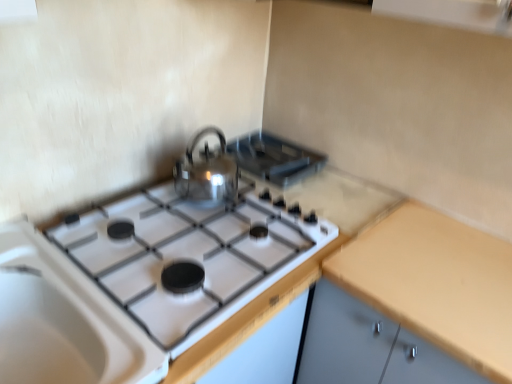
Find the location of a particular element. Image resolution: width=512 pixels, height=384 pixels. vacant point to the right of shiny metallic kettle at center is located at coordinates (273, 214).